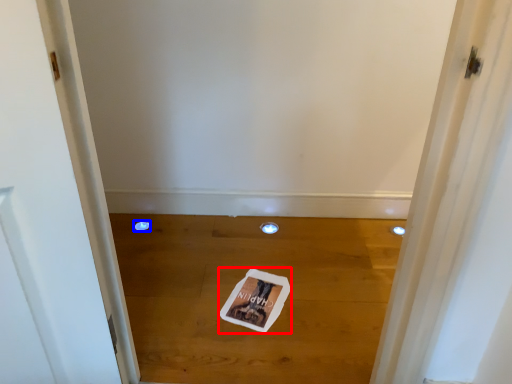
Question: Among these objects, which one is farthest to the camera, magazine (highlighted by a red box) or hole (highlighted by a blue box)?

Choices:
 (A) magazine
 (B) hole

Answer: (B)